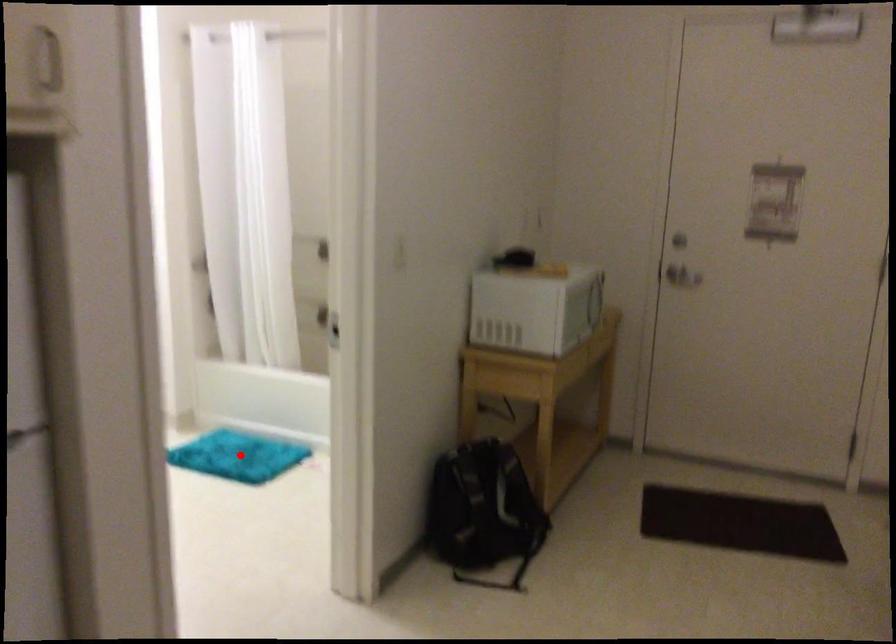
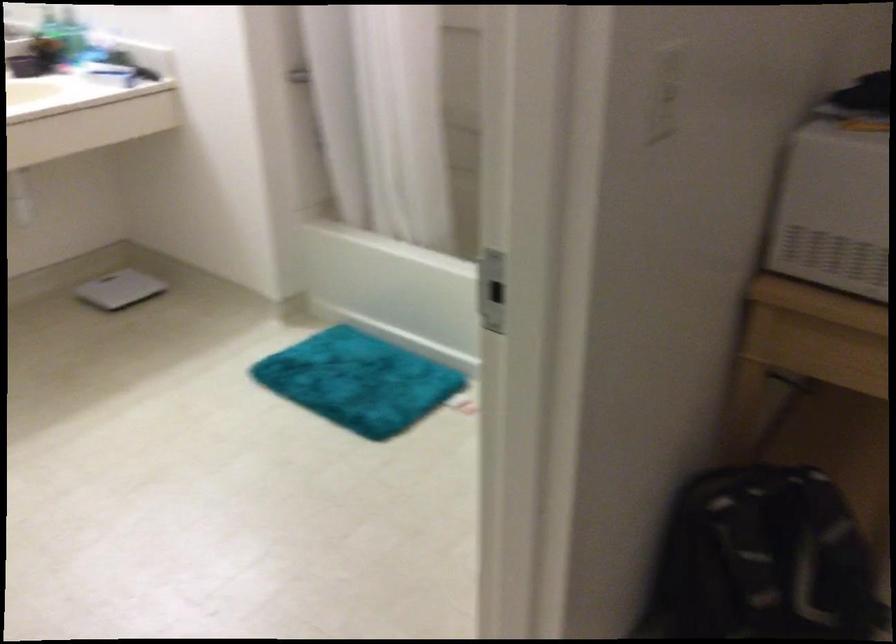
Question: I am providing you with two images of the same scene from different viewpoints. A red point is shown in image1. For the corresponding object point in image2, is it positioned nearer or farther from the camera?

Choices:
 (A) Nearer
 (B) Farther

Answer: (A)